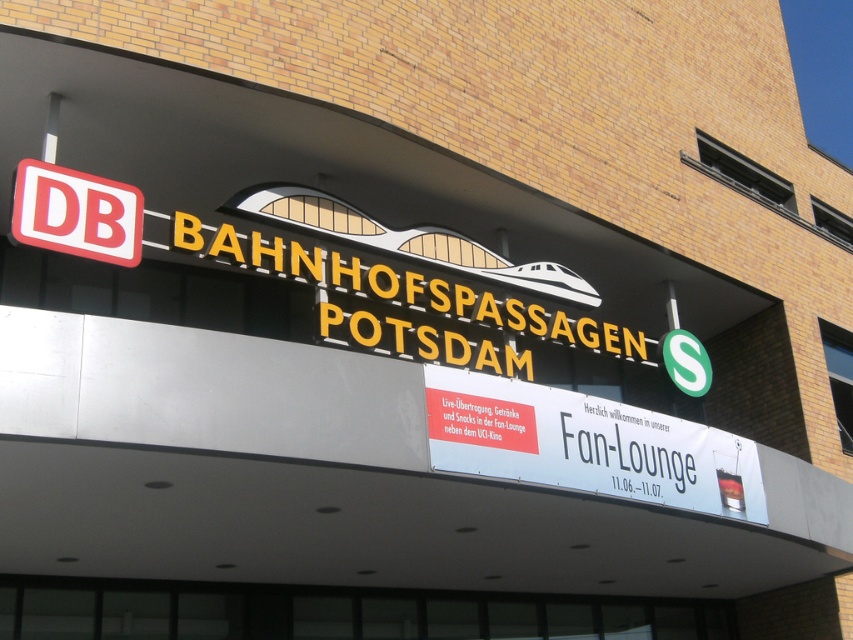
Question: Which point is farther to the camera?

Choices:
 (A) click(x=103, y=237)
 (B) click(x=473, y=445)

Answer: (B)

Question: Does white paper banner at center appear on the left side of red plastic db sign at upper left?

Choices:
 (A) no
 (B) yes

Answer: (A)

Question: In this image, where is white paper banner at center located relative to red plastic db sign at upper left?

Choices:
 (A) above
 (B) below

Answer: (B)

Question: Which point is farther to the camera?

Choices:
 (A) (570, 477)
 (B) (73, 244)

Answer: (A)

Question: Does white paper banner at center have a lesser width compared to red plastic db sign at upper left?

Choices:
 (A) no
 (B) yes

Answer: (A)

Question: Which object is closer to the camera taking this photo?

Choices:
 (A) white paper banner at center
 (B) red plastic db sign at upper left

Answer: (B)